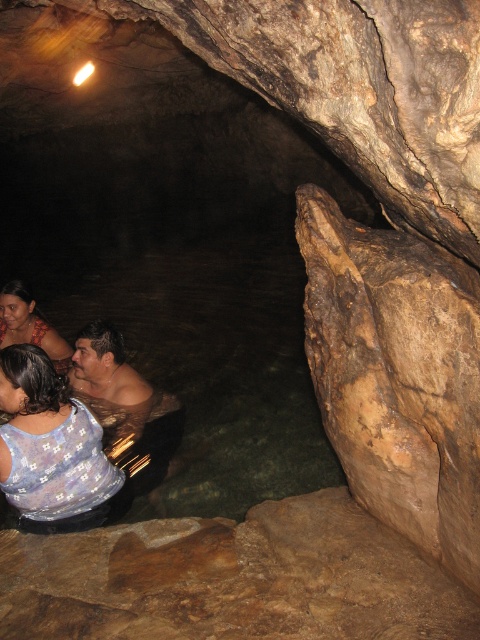
Does printed fabric blouse at lower left appear over matte brown hair at lower left?

Incorrect, printed fabric blouse at lower left is not positioned above matte brown hair at lower left.

Which is in front, point (34, 449) or point (59, 356)?

Positioned in front is point (34, 449).

This screenshot has height=640, width=480. Identify the location of printed fabric blouse at lower left. (48, 442).

Between point (325, 618) and point (49, 454), which one is positioned behind?

Point (49, 454)

Can you confirm if brown rough rock at lower center is positioned to the right of printed fabric blouse at lower left?

Correct, you'll find brown rough rock at lower center to the right of printed fabric blouse at lower left.

The image size is (480, 640). In order to click on brown rough rock at lower center in this screenshot , I will do `click(232, 579)`.

Which is above, brown rough rock at lower center or matte brown hair at lower left?

matte brown hair at lower left is higher up.

Based on the photo, can you confirm if brown rough rock at lower center is positioned to the left of matte brown hair at lower left?

No, brown rough rock at lower center is not to the left of matte brown hair at lower left.

Is point (144, 608) farther from camera compared to point (34, 307)?

That is False.

The image size is (480, 640). I want to click on brown rough rock at lower center, so click(x=232, y=579).